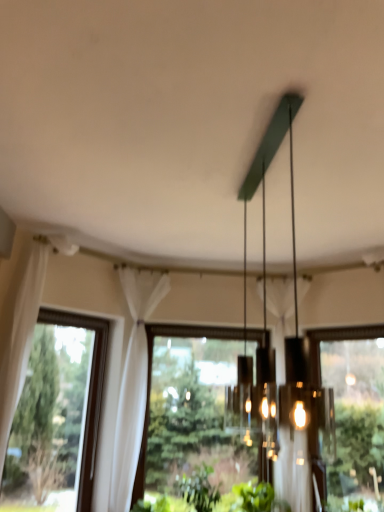
You are a GUI agent. You are given a task and a screenshot of the screen. Output one action in this format:
    pyautogui.click(x=<x>, y=<y>)
    Task: Click on the clear glass window at left, which appears as the 3th window when viewed from the right
    This screenshot has height=512, width=384.
    Given the screenshot: What is the action you would take?
    pyautogui.click(x=57, y=417)

Describe the element at coordinates (199, 489) in the screenshot. I see `green leafy plant at lower center` at that location.

This screenshot has width=384, height=512. Find the location of `white sheer curtain at left`. white sheer curtain at left is located at coordinates (133, 382).

Find the location of a particular element. This screenshot has width=384, height=512. clear glass window at left, which appears as the 3th window when viewed from the right is located at coordinates 57,417.

Is clear glass window at left, which appears as the 3th window when viewed from the right, completely or partially inside white sheer curtain at left?

No, white sheer curtain at left does not contain clear glass window at left, which appears as the 3th window when viewed from the right.

From a real-world perspective, which is physically below, white sheer curtain at left or clear glass window at left, which appears as the 1th window when viewed from the left?

In real-world perspective, clear glass window at left, which appears as the 1th window when viewed from the left, is lower.

Is white sheer curtain at left far away from clear glass window at left, which appears as the 1th window when viewed from the left?

Indeed, white sheer curtain at left is not near clear glass window at left, which appears as the 1th window when viewed from the left.

There is a white sheer curtain at left. Where is `the 1st window below it (from the image's perspective)`? This screenshot has height=512, width=384. the 1st window below it (from the image's perspective) is located at coordinates tap(57, 417).

Is point (318, 380) closer or farther from the camera than point (142, 370)?

Point (318, 380) appears to be farther away from the viewer than point (142, 370).

Is transparent glass window at right, placed as the first window when sorted from right to left, oriented towards white sheer curtain at left?

No, transparent glass window at right, placed as the first window when sorted from right to left, does not turn towards white sheer curtain at left.

Based on their positions, is transparent glass window at right, placed as the first window when sorted from right to left, located to the left or right of white sheer curtain at left?

Clearly, transparent glass window at right, placed as the first window when sorted from right to left, is on the right of white sheer curtain at left in the image.

Consider the image. Is transparent glass window at right, placed as the first window when sorted from right to left, positioned far away from white sheer curtain at left?

Yes, transparent glass window at right, placed as the first window when sorted from right to left, is far from white sheer curtain at left.

Is transparent glass window at right, placed as the first window when sorted from right to left, with green leafy plant at lower center?

No, transparent glass window at right, placed as the first window when sorted from right to left, is not in contact with green leafy plant at lower center.

Based on their positions, is transparent glass window at right, which appears as the 3th window when viewed from the left, located to the left or right of green leafy plant at lower center?

transparent glass window at right, which appears as the 3th window when viewed from the left, is positioned on green leafy plant at lower center's right side.

Locate an element on the screen. The width and height of the screenshot is (384, 512). vegetation below the transparent glass window at right, placed as the first window when sorted from right to left (from a real-world perspective) is located at coordinates (199, 489).

Can you confirm if transparent glass window at right, which appears as the 3th window when viewed from the left, is wider than green leafy plant at lower center?

No.

Looking at this image, considering the positions of objects matte green chandelier at center and clear glass window at left, which appears as the 1th window when viewed from the left, in the image provided, who is more to the left, matte green chandelier at center or clear glass window at left, which appears as the 1th window when viewed from the left,?

clear glass window at left, which appears as the 1th window when viewed from the left, is more to the left.

Which object is thinner, matte green chandelier at center or clear glass window at left, which appears as the 1th window when viewed from the left?

clear glass window at left, which appears as the 1th window when viewed from the left.

From the image's perspective, which is below, matte green chandelier at center or clear glass window at left, which appears as the 1th window when viewed from the left?

clear glass window at left, which appears as the 1th window when viewed from the left, is shown below in the image.

Can you tell me how much matte green chandelier at center and clear glass window at left, which appears as the 3th window when viewed from the right, differ in facing direction?

The facing directions of matte green chandelier at center and clear glass window at left, which appears as the 3th window when viewed from the right, are 45.7 degrees apart.

Between green leafy plant at lower center and transparent glass window at right, placed as the first window when sorted from right to left, which one appears on the right side from the viewer's perspective?

Positioned to the right is transparent glass window at right, placed as the first window when sorted from right to left.

Do you think green leafy plant at lower center is within transparent glass window at right, which appears as the 3th window when viewed from the left, or outside of it?

green leafy plant at lower center cannot be found inside transparent glass window at right, which appears as the 3th window when viewed from the left.

Between green leafy plant at lower center and transparent glass window at right, placed as the first window when sorted from right to left, which one is positioned behind?

green leafy plant at lower center is further away from the camera.

Can you confirm if green leafy plant at lower center is taller than transparent glass window at right, placed as the first window when sorted from right to left?

Incorrect, the height of green leafy plant at lower center is not larger of that of transparent glass window at right, placed as the first window when sorted from right to left.

Between transparent glass window at center, positioned as the 2th window in left-to-right order, and clear glass window at left, which appears as the 1th window when viewed from the left, which one has larger size?

transparent glass window at center, positioned as the 2th window in left-to-right order, is bigger.

Which of these two, transparent glass window at center, positioned as the 2th window in left-to-right order, or clear glass window at left, which appears as the 1th window when viewed from the left, is wider?

clear glass window at left, which appears as the 1th window when viewed from the left.

From a real-world perspective, is transparent glass window at center, positioned as the second window in right-to-left order, physically above clear glass window at left, which appears as the 1th window when viewed from the left?

Yes.

Is the position of transparent glass window at center, positioned as the 2th window in left-to-right order, less distant than that of clear glass window at left, which appears as the 1th window when viewed from the left?

No, transparent glass window at center, positioned as the 2th window in left-to-right order, is further to the viewer.

In the scene shown: Is matte green chandelier at center facing away from green leafy plant at lower center?

No, matte green chandelier at center is not facing the opposite direction of green leafy plant at lower center.

At what (x,y) coordinates should I click in order to perform the action: click on chandelier above the green leafy plant at lower center (from the image's perspective). Please return your answer as a coordinate pair (x, y). This screenshot has width=384, height=512. Looking at the image, I should click on (264, 179).

From the image's perspective, does matte green chandelier at center appear higher than green leafy plant at lower center?

Yes, from the image's perspective, matte green chandelier at center is above green leafy plant at lower center.

In the scene shown: Which object is positioned more to the right, matte green chandelier at center or green leafy plant at lower center?

matte green chandelier at center.

The height and width of the screenshot is (512, 384). What are the coordinates of `the 1st window below when counting from the white sheer curtain at left (from the image's perspective)` in the screenshot? It's located at (57, 417).

Locate an element on the screen. curtain above the transparent glass window at right, placed as the first window when sorted from right to left (from a real-world perspective) is located at coordinates (133, 382).

Based on their spatial positions, is transparent glass window at right, which appears as the 3th window when viewed from the left, or transparent glass window at center, positioned as the second window in right-to-left order, closer to clear glass window at left, which appears as the 1th window when viewed from the left?

Among the two, transparent glass window at center, positioned as the second window in right-to-left order, is located nearer to clear glass window at left, which appears as the 1th window when viewed from the left.

Based on their spatial positions, is transparent glass window at center, positioned as the 2th window in left-to-right order, or white sheer curtain at left closer to green leafy plant at lower center?

Based on the image, transparent glass window at center, positioned as the 2th window in left-to-right order, appears to be nearer to green leafy plant at lower center.

Based on their spatial positions, is transparent glass window at right, placed as the first window when sorted from right to left, or clear glass window at left, which appears as the 1th window when viewed from the left, closer to green leafy plant at lower center?

The object closer to green leafy plant at lower center is transparent glass window at right, placed as the first window when sorted from right to left.

Estimate the real-world distances between objects in this image. Which object is closer to transparent glass window at center, positioned as the second window in right-to-left order, white sheer curtain at left or matte green chandelier at center?

white sheer curtain at left is closer to transparent glass window at center, positioned as the second window in right-to-left order.

Looking at the image, which one is located further to transparent glass window at right, which appears as the 3th window when viewed from the left, green leafy plant at lower center or clear glass window at left, which appears as the 1th window when viewed from the left?

clear glass window at left, which appears as the 1th window when viewed from the left.

Considering their positions, is green leafy plant at lower center positioned closer to transparent glass window at center, positioned as the 2th window in left-to-right order, than transparent glass window at right, placed as the first window when sorted from right to left?

green leafy plant at lower center lies closer to transparent glass window at center, positioned as the 2th window in left-to-right order, than the other object.

Which object lies further to the anchor point green leafy plant at lower center, transparent glass window at center, positioned as the 2th window in left-to-right order, or clear glass window at left, which appears as the 1th window when viewed from the left?

clear glass window at left, which appears as the 1th window when viewed from the left.

Looking at this image, from the image, which object appears to be farther from white sheer curtain at left, matte green chandelier at center or transparent glass window at center, positioned as the second window in right-to-left order?

Among the two, matte green chandelier at center is located further to white sheer curtain at left.

Where is `vegetation between matte green chandelier at center and transparent glass window at center, positioned as the second window in right-to-left order, from front to back`? vegetation between matte green chandelier at center and transparent glass window at center, positioned as the second window in right-to-left order, from front to back is located at coordinates (199, 489).

At what (x,y) coordinates should I click in order to perform the action: click on window between green leafy plant at lower center and transparent glass window at right, placed as the first window when sorted from right to left, from left to right. Please return your answer as a coordinate pair (x, y). Looking at the image, I should click on (200, 410).

Find the location of a particular element. The width and height of the screenshot is (384, 512). curtain situated between clear glass window at left, which appears as the 1th window when viewed from the left, and green leafy plant at lower center from left to right is located at coordinates (133, 382).

Locate an element on the screen. window between clear glass window at left, which appears as the 3th window when viewed from the right, and transparent glass window at right, placed as the first window when sorted from right to left, in the horizontal direction is located at coordinates (200, 410).